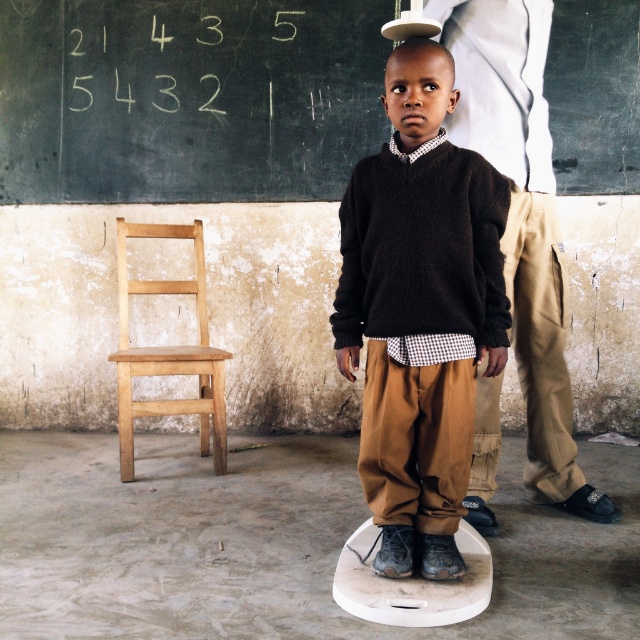
The child is standing on a scale in a classroom. The black chalkboard at upper center is located at point (188, 99). Where is the black chalkboard in relation to the child?

The black chalkboard at upper center is located at point (188, 99), which is above and to the left of the child standing on the scale.

You are a teacher in the classroom. You notice the black chalkboard at upper center and the black wool sweater at center. Which object takes up more space in the image?

The black chalkboard at upper center is bigger than the black wool sweater at center, so it takes up more space in the image.

You are a teacher in the classroom and want to place a sticker on the wall between the two points, point (278, 74) and point (221, 456). Which point is closer to the front of the classroom so the sticker is more visible?

Point (278, 74) is further to the viewer than point (221, 456), so the sticker placed closer to point (278, 74) will be more visible as it is nearer to the front of the classroom.